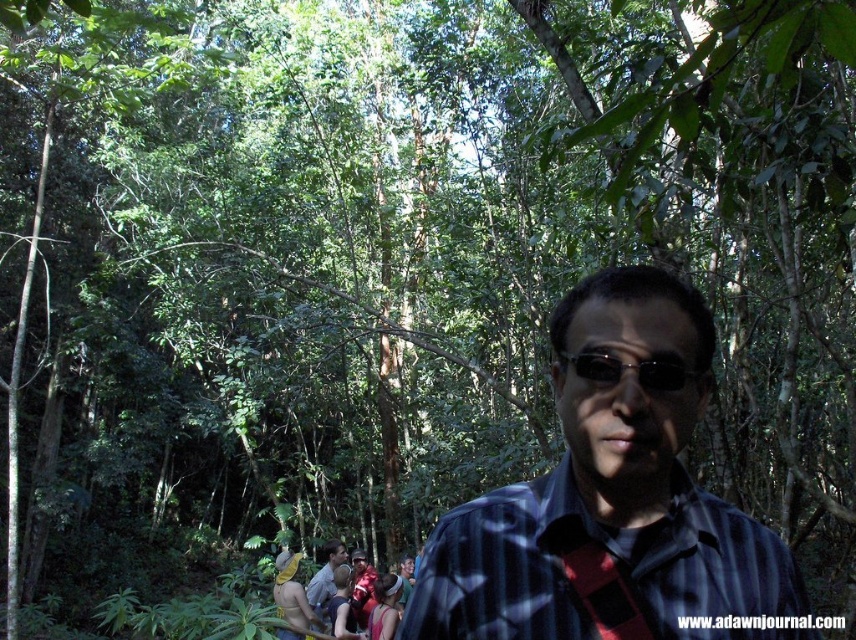
Does red fabric tie at center have a lesser width compared to black plastic sunglasses at center?

Yes, red fabric tie at center is thinner than black plastic sunglasses at center.

Does red fabric tie at center have a lesser height compared to black plastic sunglasses at center?

Incorrect, red fabric tie at center's height does not fall short of black plastic sunglasses at center's.

Between point (640, 625) and point (664, 381), which one is positioned in front?

Point (664, 381) is in front.

The height and width of the screenshot is (640, 856). Find the location of `red fabric tie at center`. red fabric tie at center is located at coordinates (603, 592).

Is blue striped shirt at center below matte blue shirt at lower center?

No, blue striped shirt at center is not below matte blue shirt at lower center.

You are a GUI agent. You are given a task and a screenshot of the screen. Output one action in this format:
    pyautogui.click(x=<x>, y=<y>)
    Task: Click on the blue striped shirt at center
    The height and width of the screenshot is (640, 856).
    Given the screenshot: What is the action you would take?
    pyautogui.click(x=611, y=506)

Between black plastic sunglasses at center and matte blue shirt at lower center, which one has less height?

black plastic sunglasses at center is shorter.

Who is taller, black plastic sunglasses at center or matte blue shirt at lower center?

matte blue shirt at lower center

Find the location of a particular element. This screenshot has width=856, height=640. black plastic sunglasses at center is located at coordinates (628, 369).

This screenshot has width=856, height=640. Find the location of `black plastic sunglasses at center`. black plastic sunglasses at center is located at coordinates (628, 369).